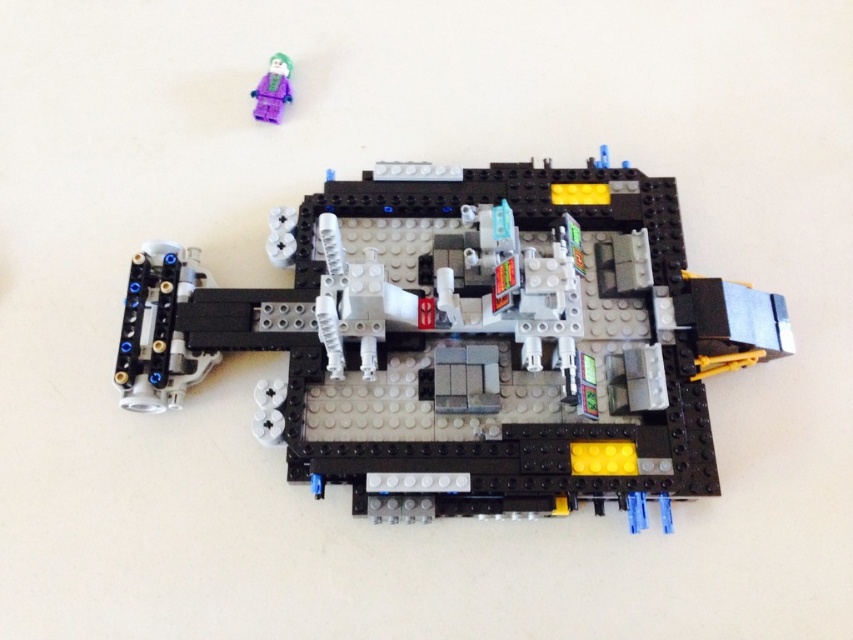
In the LEGO Batmobile scene, where is the black plastic vehicle at center in relation to the purple matte minifigure at upper left?

The black plastic vehicle at center is located to the right of the purple matte minifigure at upper left.

You are a LEGO designer examining the Batmobile model. You notice two points on the vehicle. The first point is at coordinate [164,273] and the second is at [274,104]. From the front of the Batmobile, which point is closer to you?

Point [164,273] is in front of point [274,104], so it is closer to you when viewed from the front of the Batmobile.